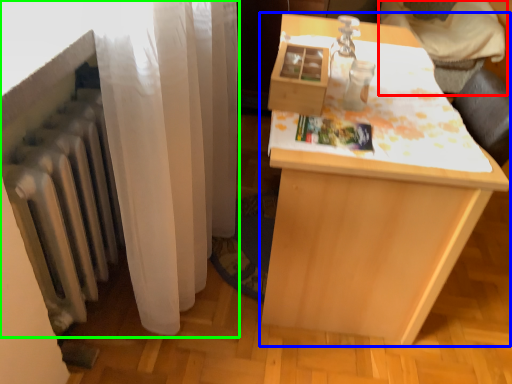
Question: Which is nearer to the furniture (highlighted by a red box)? table (highlighted by a blue box) or curtain (highlighted by a green box).

Choices:
 (A) table
 (B) curtain

Answer: (A)